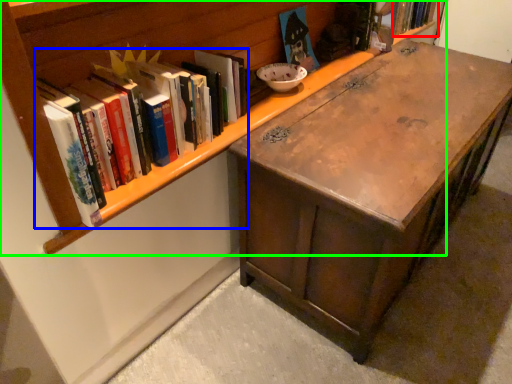
Question: Which is nearer to the book (highlighted by a red box)? book (highlighted by a blue box) or bookcase (highlighted by a green box).

Choices:
 (A) book
 (B) bookcase

Answer: (B)